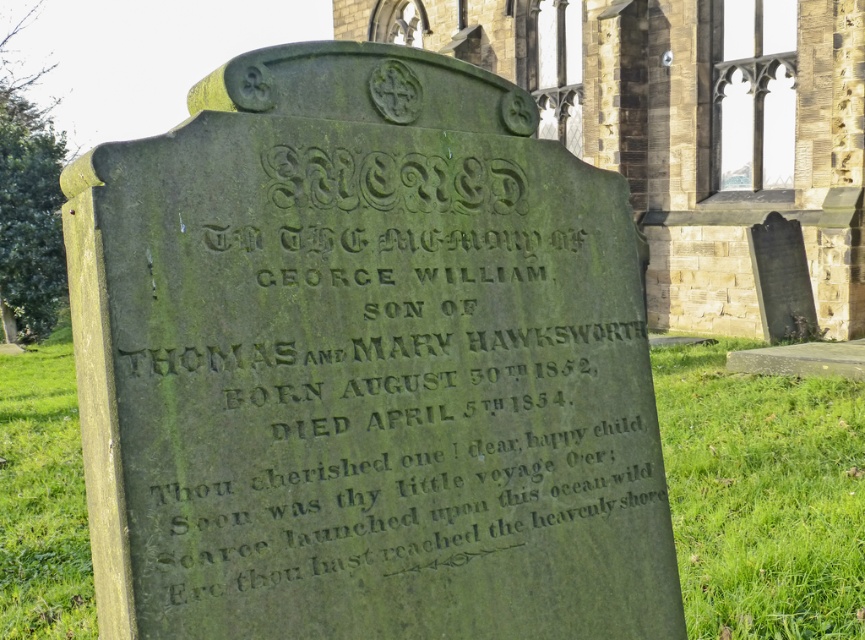
What is located at the coordinates point [686,125]?

A stone church at center is located at point [686,125].

You are standing in a cemetery and see two objects labeled as green mossy stone monument at center and green mossy stone at center. Which one is nearer to you?

The green mossy stone monument at center is closer to the viewer than the green mossy stone at center.

Consider the image. What is the 2D coordinate of the green mossy stone monument at center in the image?

The 2D coordinate of the green mossy stone monument at center is at point (364,364).